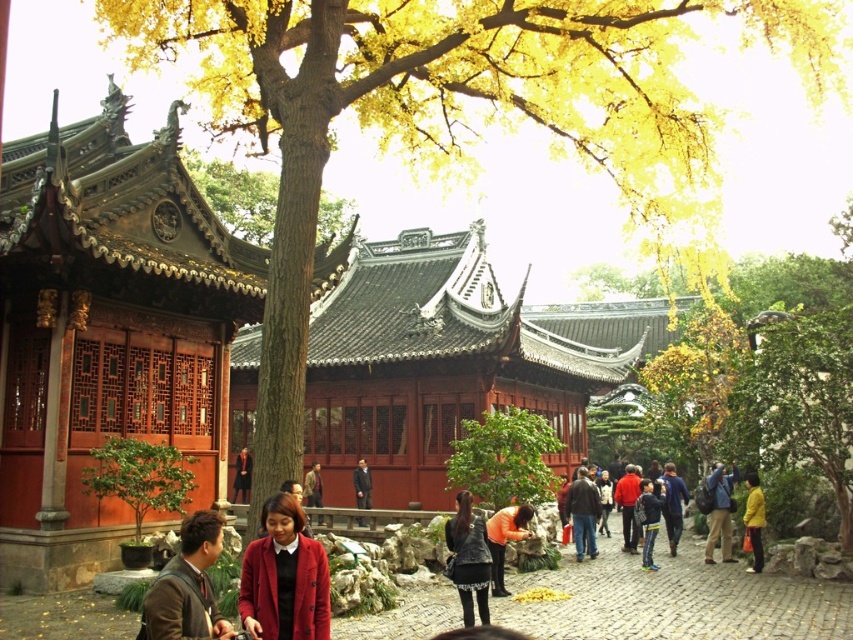
Question: Which point is closer to the camera?

Choices:
 (A) dark gray suit at center
 (B) smooth brown bark at center

Answer: (B)

Question: Is smooth brown bark at center above dark gray suit at center?

Choices:
 (A) no
 (B) yes

Answer: (B)

Question: Which point is closer to the camera?

Choices:
 (A) (325, 204)
 (B) (747, 540)
 (C) (726, 547)
 (D) (364, 465)

Answer: (B)

Question: Does matte red coat at center have a lesser width compared to smooth brown bark at center?

Choices:
 (A) yes
 (B) no

Answer: (A)

Question: Does green leafy tree at center appear on the left side of smooth brown bark at center?

Choices:
 (A) no
 (B) yes

Answer: (A)

Question: Which object appears farthest from the camera in this image?

Choices:
 (A) red velvet coat at center
 (B) red wool coat at center
 (C) brown leather jacket at center
 (D) leather jacket at center

Answer: (A)